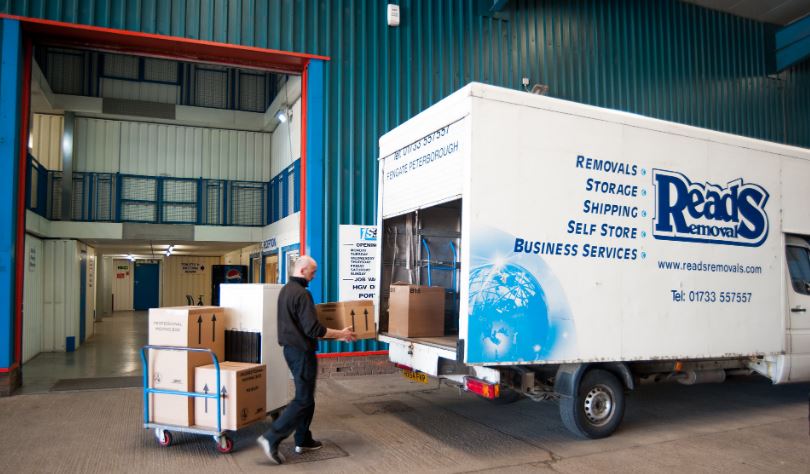
Find the location of a particular element. The image size is (810, 474). box is located at coordinates (249, 382).